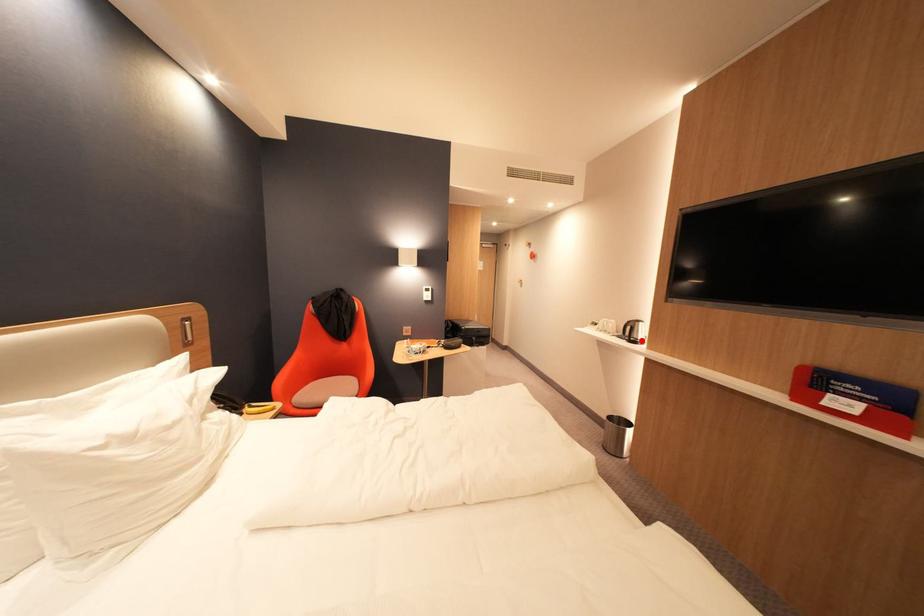
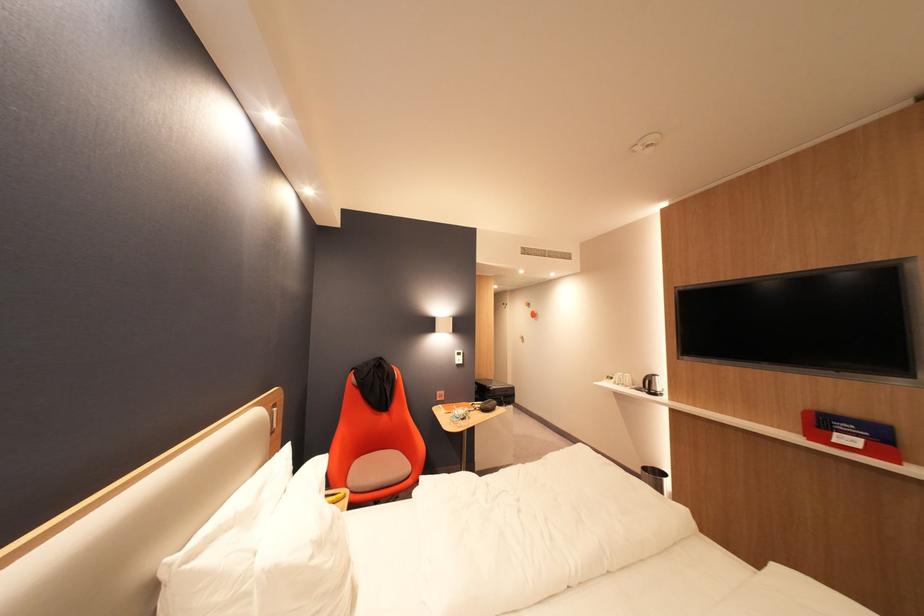
Find the pixel in the second image that matches the highlighted location in the first image.

(662, 392)